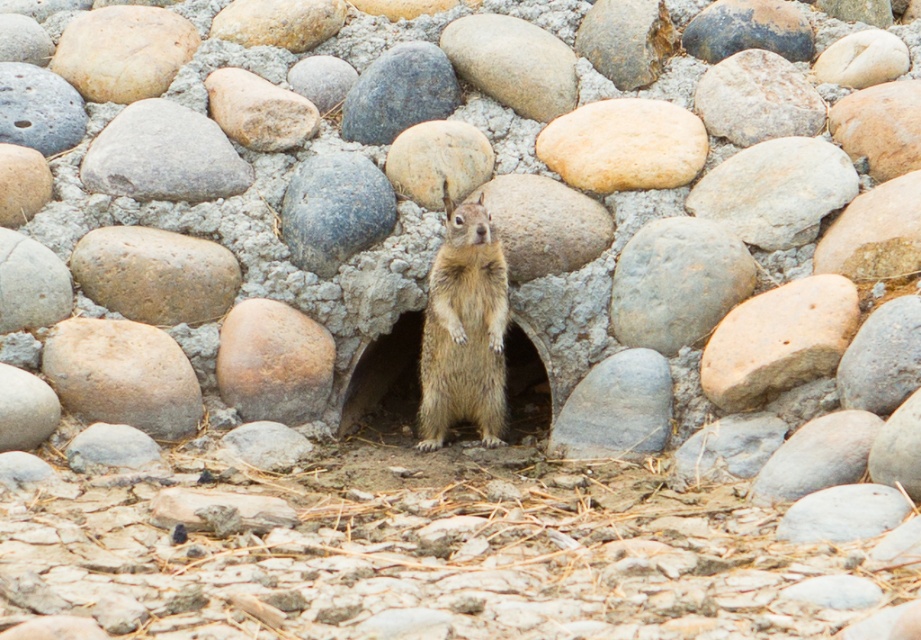
Question: Does smooth beige rock at upper left have a lesser width compared to gray smooth rock at center?

Choices:
 (A) yes
 (B) no

Answer: (B)

Question: Is the position of gray smooth rock at center more distant than that of brown dirt at center?

Choices:
 (A) yes
 (B) no

Answer: (B)

Question: Which point is closer to the camera?

Choices:
 (A) (500, 401)
 (B) (615, 141)

Answer: (A)

Question: Where is brown rough rock at center located in relation to smooth gray rock at center in the image?

Choices:
 (A) left
 (B) right

Answer: (A)

Question: Among these points, which one is nearest to the camera?

Choices:
 (A) (381, 396)
 (B) (232, 192)
 (C) (578, 384)

Answer: (C)

Question: Which object is farther from the camera taking this photo?

Choices:
 (A) smooth gray rock at center
 (B) gray smooth rock at center

Answer: (A)